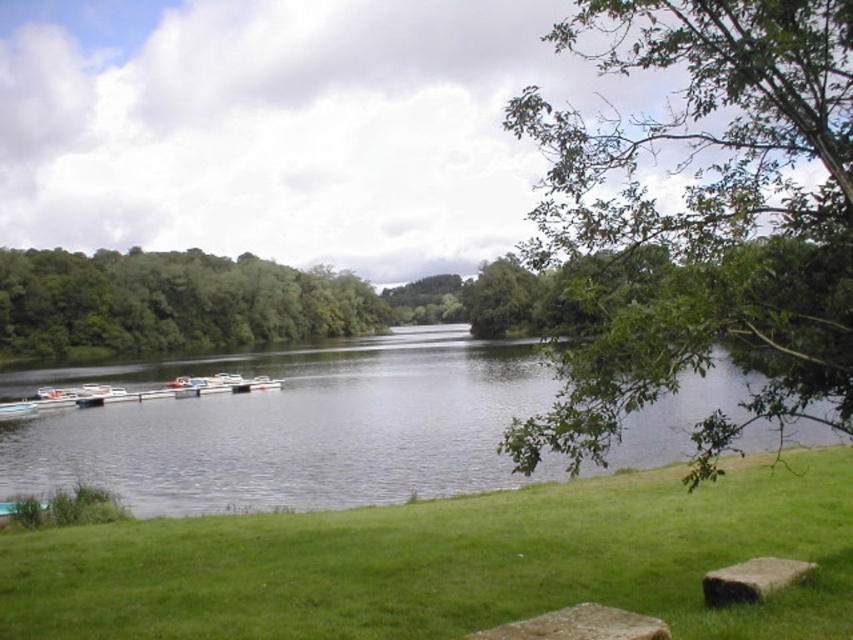
Question: Which object is closer to the camera taking this photo?

Choices:
 (A) white plastic boats at lower left
 (B) green leafy tree at upper right

Answer: (B)

Question: Based on their relative distances, which object is nearer to the rustic stone bench at lower center?

Choices:
 (A) green leafy trees at left
 (B) green grassy at lower left

Answer: (B)

Question: Is the position of green grassy at lower left less distant than that of green smooth water at center?

Choices:
 (A) no
 (B) yes

Answer: (B)

Question: Which point appears farthest from the camera in this image?

Choices:
 (A) pyautogui.click(x=10, y=410)
 (B) pyautogui.click(x=619, y=618)
 (C) pyautogui.click(x=138, y=387)

Answer: (C)

Question: Does green grassy at lower left appear on the left side of rustic stone bench at lower center?

Choices:
 (A) yes
 (B) no

Answer: (B)

Question: Can you confirm if green leafy tree at upper right is positioned to the left of green smooth water at center?

Choices:
 (A) no
 (B) yes

Answer: (A)